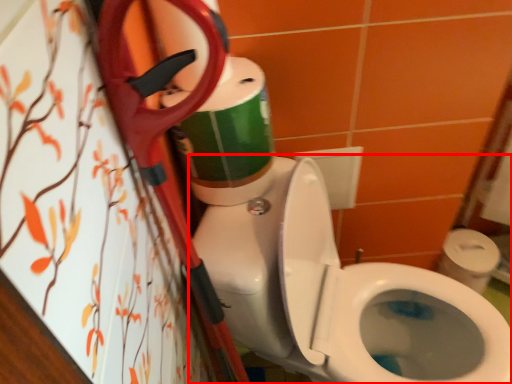
Question: From the image's perspective, where is toilet (annotated by the red box) located relative to toilet paper?

Choices:
 (A) below
 (B) above

Answer: (A)